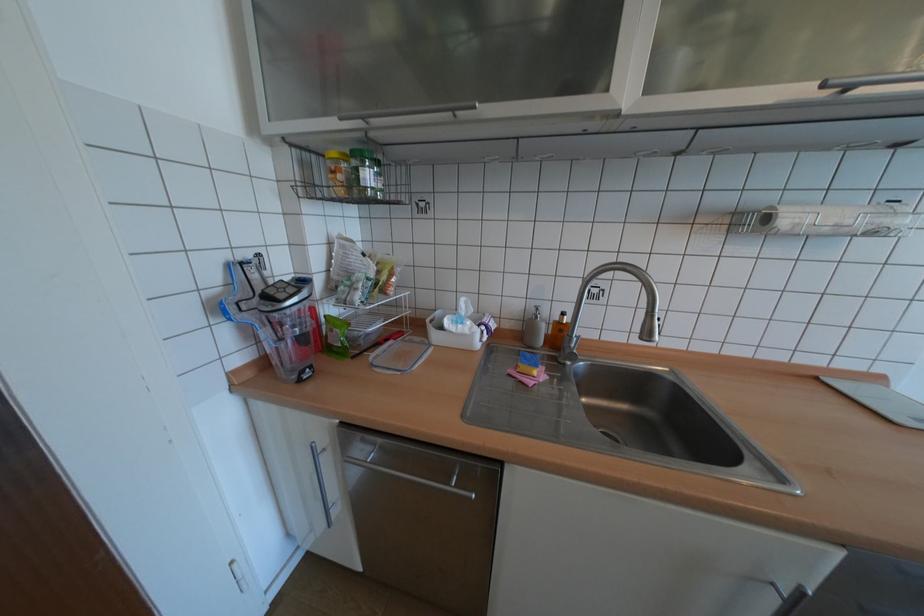
Where would you pull the top right cabinet handle? Please return your answer as a coordinate pair (x, y).

(869, 81)